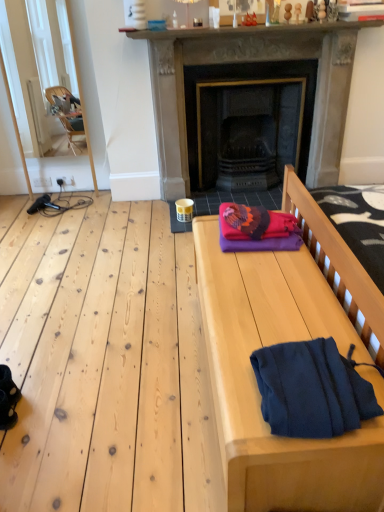
Where is `empty space that is in between dark blue fleece at lower right and knitted woolen blanket at center`? empty space that is in between dark blue fleece at lower right and knitted woolen blanket at center is located at coordinates (281, 295).